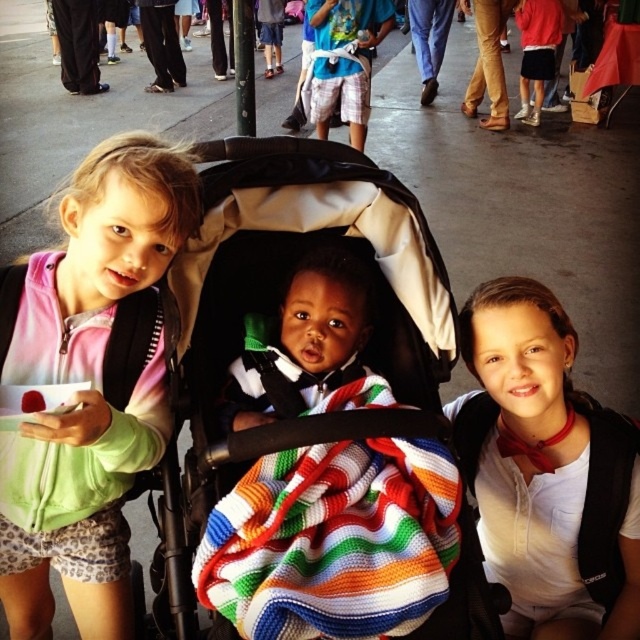
In the scene shown: You are a photographer trying to capture a closeup of the striped knit sweater at center without the multicolored knitted blanket at center blocking the view. Is this possible?

The multicolored knitted blanket at center is closer to the viewer than the striped knit sweater at center, so the blanket would block the view of the sweater. Therefore, it is not possible to take a closeup of the striped knit sweater at center without the blanket obstructing it.